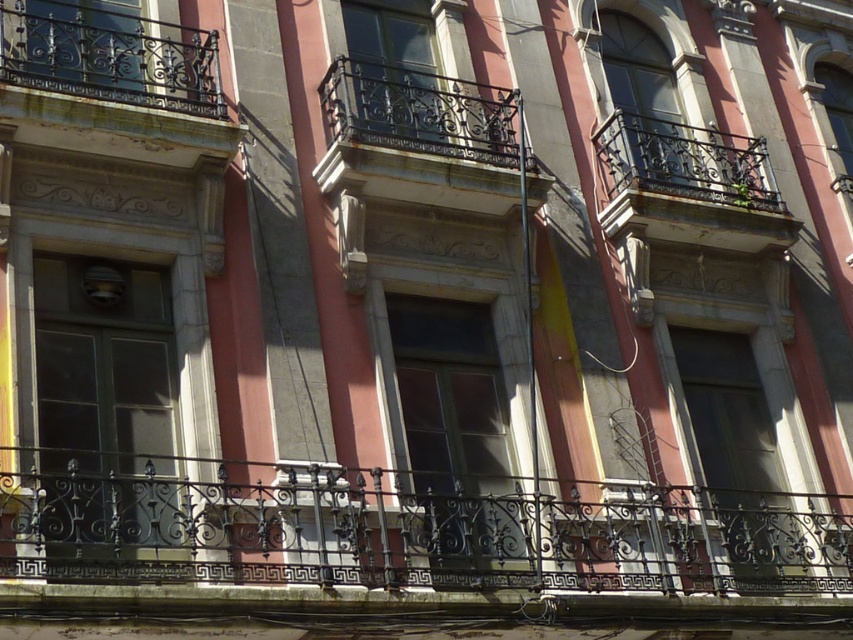
Does point (88, 70) lie behind point (352, 193)?

No, it is not.

Based on the photo, can you confirm if rusty wrought iron balcony at upper left is positioned above black wrought iron balcony at center?

Indeed, rusty wrought iron balcony at upper left is positioned over black wrought iron balcony at center.

Does point (97, 108) come in front of point (431, 179)?

Yes.

What are the coordinates of `rusty wrought iron balcony at upper left` in the screenshot? It's located at (113, 88).

Is rusty wrought iron balcony at upper left thinner than rusty metal balcony at upper center?

Indeed, rusty wrought iron balcony at upper left has a lesser width compared to rusty metal balcony at upper center.

Can you confirm if rusty wrought iron balcony at upper left is positioned to the right of rusty metal balcony at upper center?

In fact, rusty wrought iron balcony at upper left is to the left of rusty metal balcony at upper center.

Locate an element on the screen. The width and height of the screenshot is (853, 640). rusty wrought iron balcony at upper left is located at coordinates (113, 88).

Where is `black wrought iron railing at center`? black wrought iron railing at center is located at coordinates (404, 529).

Does point (518, 524) come closer to viewer compared to point (148, 92)?

Yes, point (518, 524) is closer to viewer.

I want to click on black wrought iron railing at center, so click(x=404, y=529).

This screenshot has height=640, width=853. I want to click on black wrought iron railing at center, so click(x=404, y=529).